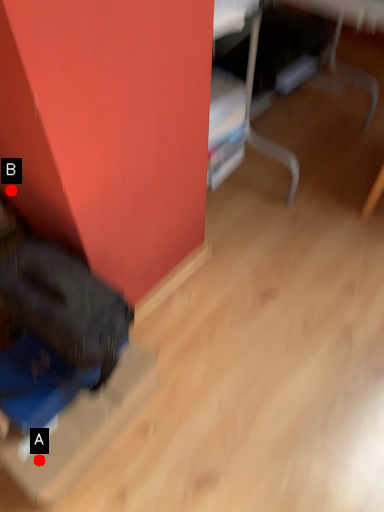
Question: Two points are circled on the image, labeled by A and B beside each circle. Which point is closer to the camera?

Choices:
 (A) A is closer
 (B) B is closer

Answer: (A)